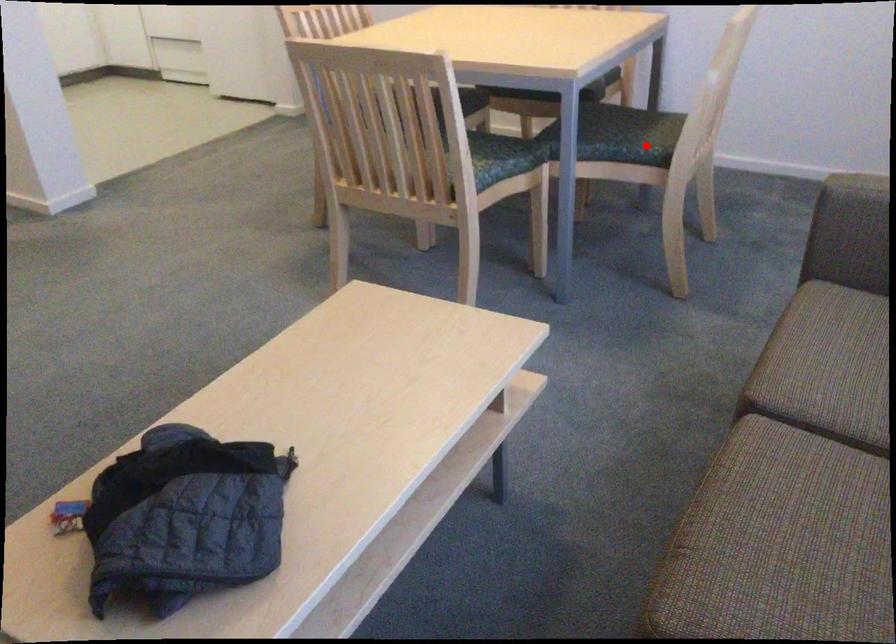
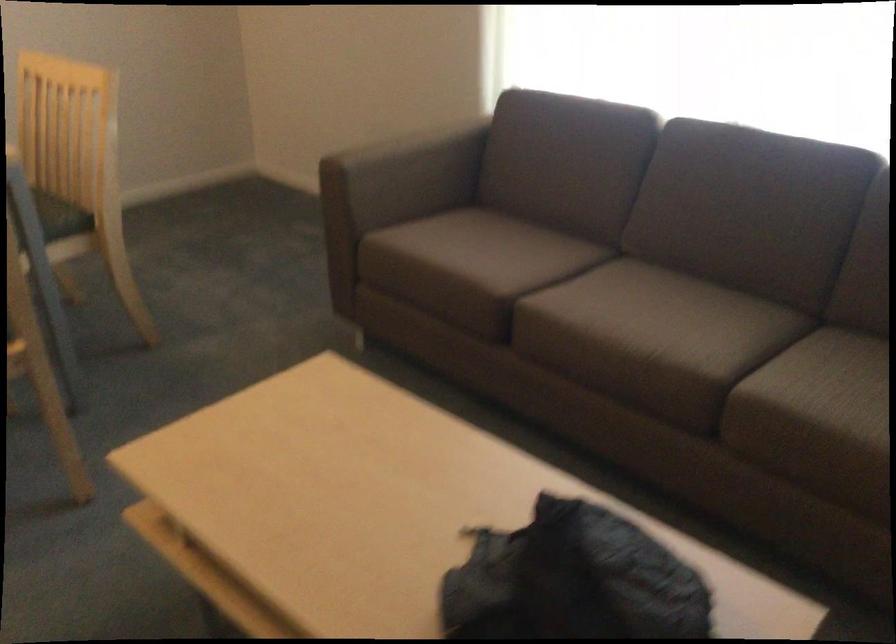
Question: I am providing you with two images of the same scene from different viewpoints. Image1 has a red point marked. In image2, the corresponding 3D location appears at what relative position? Reply with the corresponding letter.

Choices:
 (A) Closer
 (B) Farther

Answer: (A)